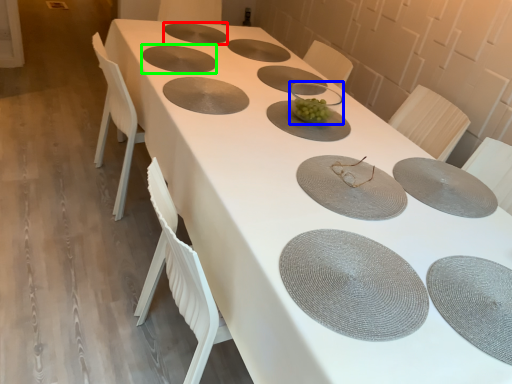
Question: Estimate the real-world distances between objects in this image. Which object is farther from tableware (highlighted by a red box), tableware (highlighted by a blue box) or tableware (highlighted by a green box)?

Choices:
 (A) tableware
 (B) tableware

Answer: (A)